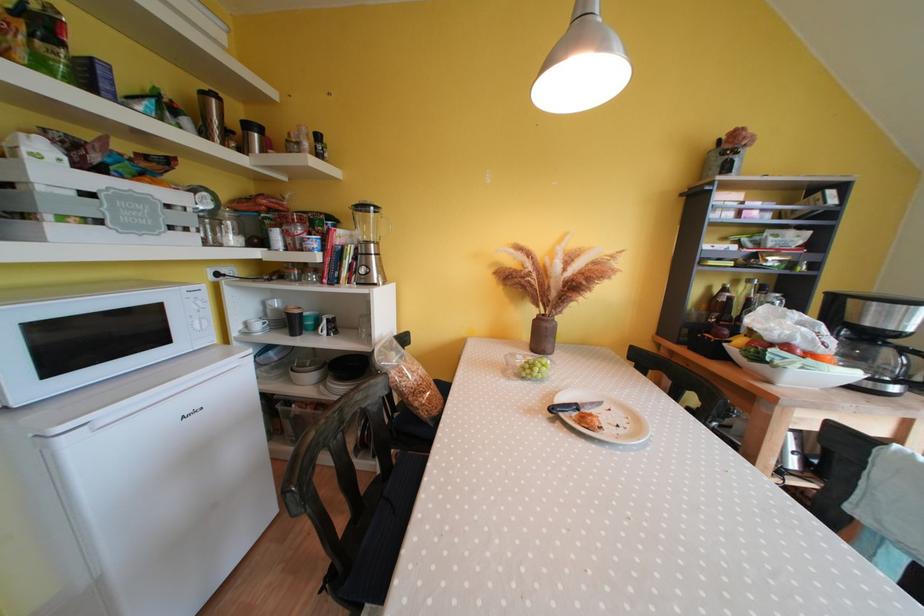
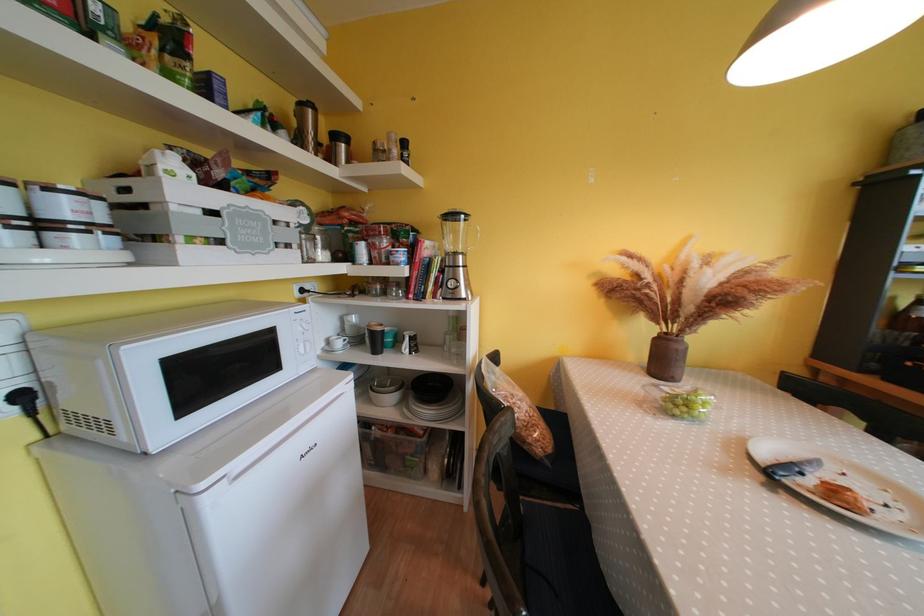
Find the pixel in the second image that matches (304,370) in the first image.

(383, 390)